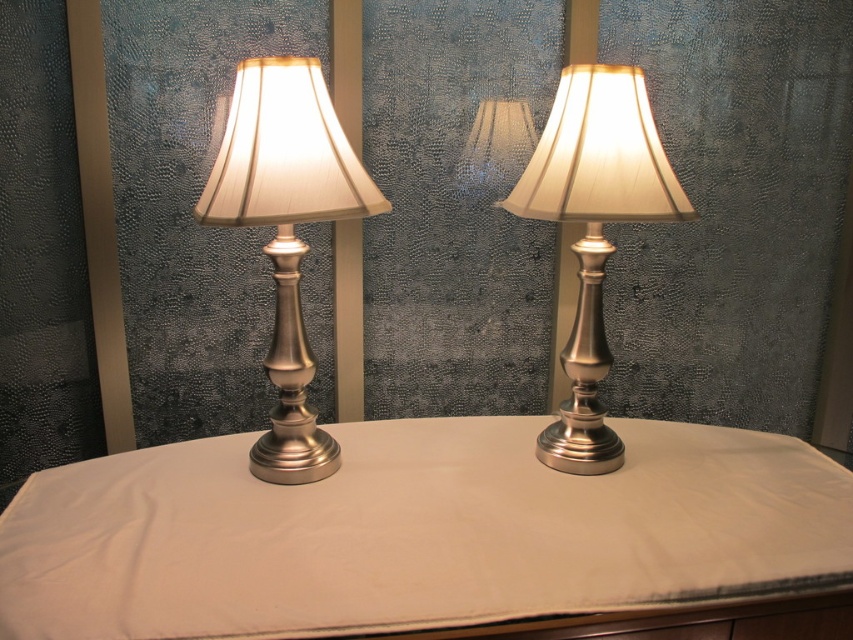
Consider the image. You are standing in front of the two table lamps and want to place a small vase between them. Since both lamps are identical, how can you ensure the vase is centered between the white fabric table at center and the brushed metal table lamp at center?

The white fabric table at center is in front of the brushed metal table lamp at center, so to center the vase between them, place it halfway between the front edge of the white fabric table at center and the back edge of the brushed metal table lamp at center.

You are setting up a display and need to place a decorative item between the satin silver table lamp at left and the brushed metal table lamp at center. Given their sizes, which lamp will require more space on the table?

The satin silver table lamp at left has a larger size compared to the brushed metal table lamp at center, so it will require more space on the table.